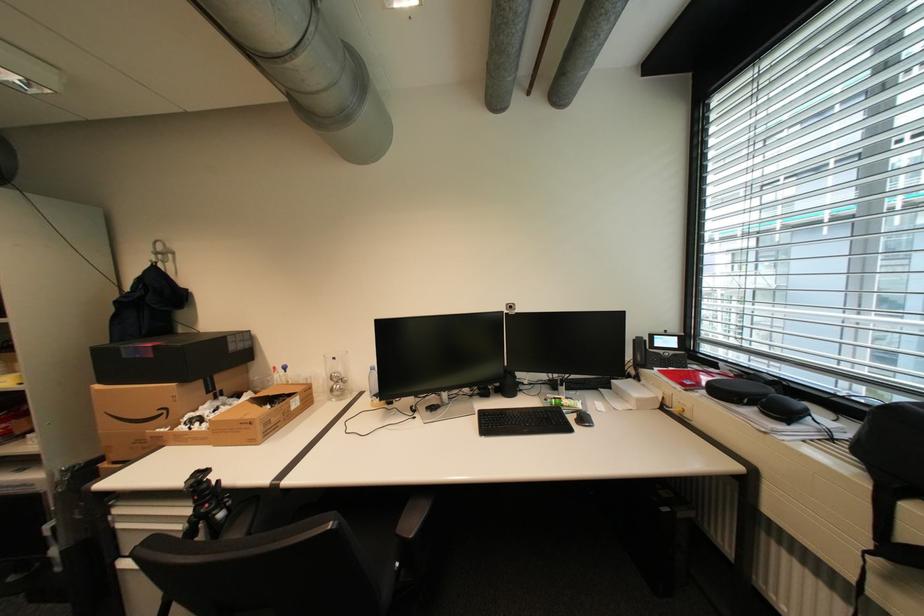
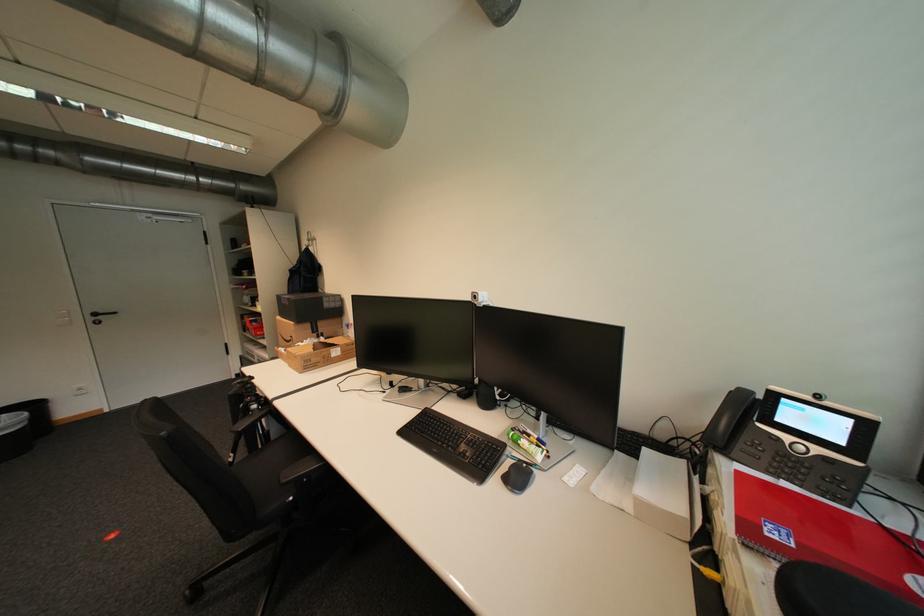
Where in the second image is the point corresponding to point (518, 307) from the first image?

(483, 297)